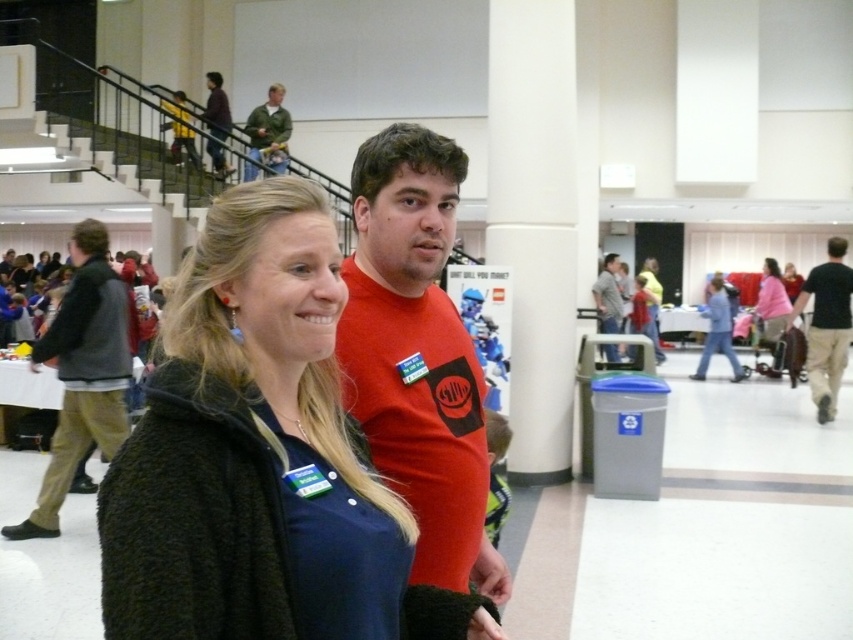
You are organizing a clothing donation drive and need to sort shirts by size. You have two shirts in front of you labeled as black cotton shirt at right and gray cotton shirt at center. Which shirt should you place in the large size bin?

The gray cotton shirt at center should be placed in the large size bin because the black cotton shirt at right has a smaller size compared to it.